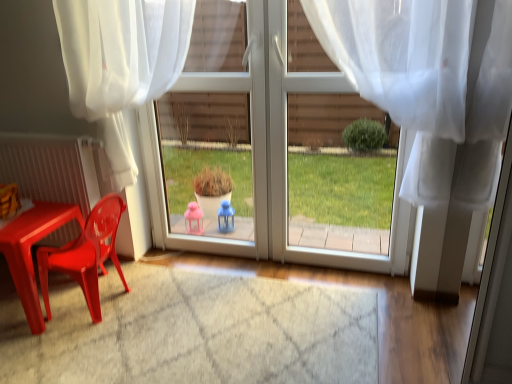
Question: Should I look upward or downward to see white glossy door at center?

Choices:
 (A) up
 (B) down

Answer: (A)

Question: From the image's perspective, does matte plastic chair at left appear lower than translucent white curtain at center, positioned as the 1th curtain in right-to-left order?

Choices:
 (A) no
 (B) yes

Answer: (B)

Question: Does matte plastic chair at left have a smaller size compared to translucent white curtain at center, marked as the 2th curtain in a left-to-right arrangement?

Choices:
 (A) yes
 (B) no

Answer: (A)

Question: Considering the relative sizes of matte plastic chair at left and translucent white curtain at center, marked as the 2th curtain in a left-to-right arrangement, in the image provided, is matte plastic chair at left wider than translucent white curtain at center, marked as the 2th curtain in a left-to-right arrangement,?

Choices:
 (A) no
 (B) yes

Answer: (B)

Question: Is translucent white curtain at center, positioned as the 1th curtain in right-to-left order, completely or partially inside matte plastic chair at left?

Choices:
 (A) no
 (B) yes

Answer: (A)

Question: Is matte plastic chair at left bigger than translucent white curtain at center, positioned as the 1th curtain in right-to-left order?

Choices:
 (A) no
 (B) yes

Answer: (A)

Question: Is matte plastic chair at left to the right of translucent white curtain at center, positioned as the 1th curtain in right-to-left order, from the viewer's perspective?

Choices:
 (A) yes
 (B) no

Answer: (B)

Question: Can white sheer curtain at upper left, which is counted as the 1th curtain, starting from the left, be found inside matte plastic chair at left?

Choices:
 (A) no
 (B) yes

Answer: (A)

Question: Are matte plastic chair at left and white sheer curtain at upper left, which ranks as the 2th curtain in right-to-left order, located far from each other?

Choices:
 (A) no
 (B) yes

Answer: (A)

Question: Considering the relative sizes of matte plastic chair at left and white sheer curtain at upper left, which is counted as the 1th curtain, starting from the left, in the image provided, is matte plastic chair at left smaller than white sheer curtain at upper left, which is counted as the 1th curtain, starting from the left,?

Choices:
 (A) yes
 (B) no

Answer: (A)

Question: From the image's perspective, would you say matte plastic chair at left is positioned over white sheer curtain at upper left, which is counted as the 1th curtain, starting from the left?

Choices:
 (A) no
 (B) yes

Answer: (A)

Question: Does matte plastic chair at left come in front of white sheer curtain at upper left, which ranks as the 2th curtain in right-to-left order?

Choices:
 (A) yes
 (B) no

Answer: (B)

Question: Considering the relative sizes of matte plastic chair at left and white sheer curtain at upper left, which is counted as the 1th curtain, starting from the left, in the image provided, is matte plastic chair at left wider than white sheer curtain at upper left, which is counted as the 1th curtain, starting from the left,?

Choices:
 (A) no
 (B) yes

Answer: (B)

Question: Can you confirm if white sheer curtain at upper left, which is counted as the 1th curtain, starting from the left, is wider than matte plastic table at lower left?

Choices:
 (A) no
 (B) yes

Answer: (A)